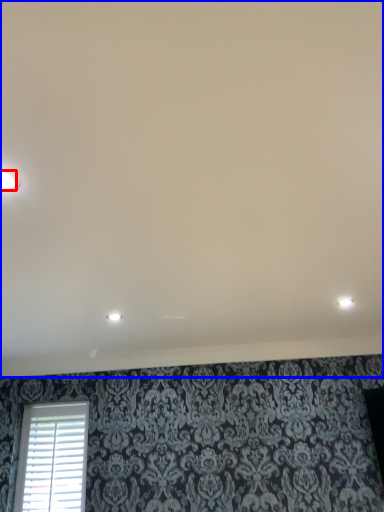
Question: Among these objects, which one is nearest to the camera, dot (highlighted by a red box) or backdrop (highlighted by a blue box)?

Choices:
 (A) dot
 (B) backdrop

Answer: (B)